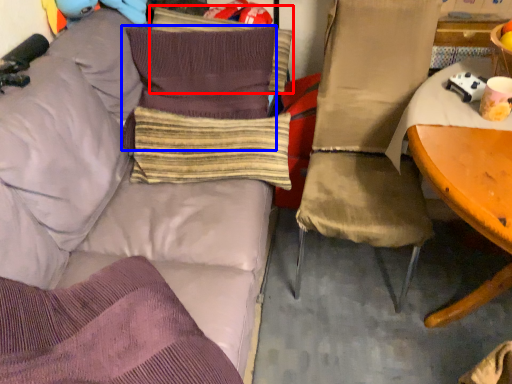
Question: Which point is closer to the camera, pillow (highlighted by a red box) or pillow (highlighted by a blue box)?

Choices:
 (A) pillow
 (B) pillow

Answer: (B)